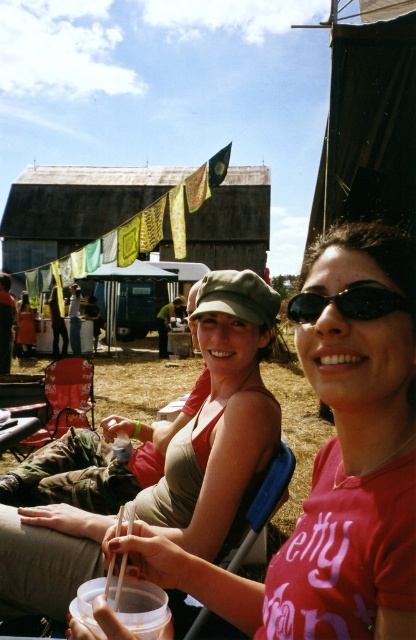
From the picture: Who is higher up, matte green cap at center or black plastic sunglasses at center?

black plastic sunglasses at center is above.

Between matte green cap at center and black plastic sunglasses at center, which one appears on the left side from the viewer's perspective?

From the viewer's perspective, black plastic sunglasses at center appears more on the left side.

Which is behind, point (341, 572) or point (302, 314)?

The point (302, 314) is behind.

This screenshot has height=640, width=416. I want to click on matte green cap at center, so click(329, 502).

Is matte green cap at center above matte khaki cap at center?

Yes.

Is matte green cap at center to the right of matte khaki cap at center from the viewer's perspective?

Yes, matte green cap at center is to the right of matte khaki cap at center.

Is point (312, 515) in front of point (215, 300)?

Yes, point (312, 515) is in front of point (215, 300).

I want to click on matte green cap at center, so click(329, 502).

Is point (202, 545) positioned before point (388, 294)?

That is False.

Does matte khaki cap at center appear on the right side of black plastic sunglasses at center?

No, matte khaki cap at center is not to the right of black plastic sunglasses at center.

Based on the photo, who is more forward, (136, 428) or (354, 316)?

Point (354, 316)

Find the location of `matte khaki cap at center`. matte khaki cap at center is located at coordinates (220, 420).